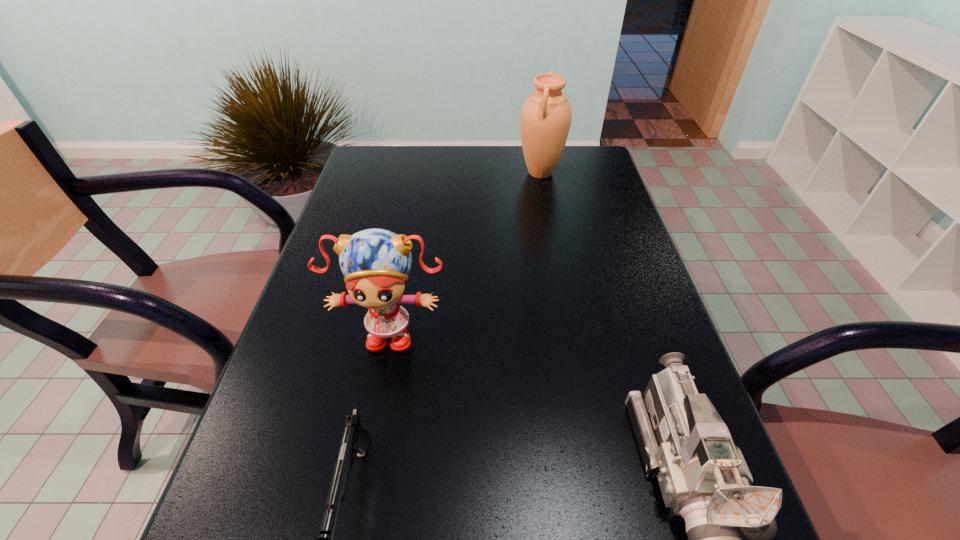
Where is `the second object from right to left`? This screenshot has width=960, height=540. the second object from right to left is located at coordinates [546, 115].

Find the location of a particular element. The width and height of the screenshot is (960, 540). urn is located at coordinates (546, 115).

Locate an element on the screen. doll is located at coordinates (375, 262).

The image size is (960, 540). I want to click on the third shortest object, so click(x=375, y=262).

I want to click on vacant space positioned 0.090m on the right of the farthest object, so click(x=591, y=173).

The width and height of the screenshot is (960, 540). I want to click on vacant space situated 0.140m on the face of the third nearest object, so click(372, 422).

Find the location of a particular element. This screenshot has height=540, width=960. object that is at the far edge is located at coordinates (546, 115).

Locate an element on the screen. The height and width of the screenshot is (540, 960). object at the left edge is located at coordinates (375, 262).

Image resolution: width=960 pixels, height=540 pixels. What are the coordinates of `object that is at the right edge` in the screenshot? It's located at (546, 115).

This screenshot has height=540, width=960. In order to click on object located at the far right corner in this screenshot , I will do `click(546, 115)`.